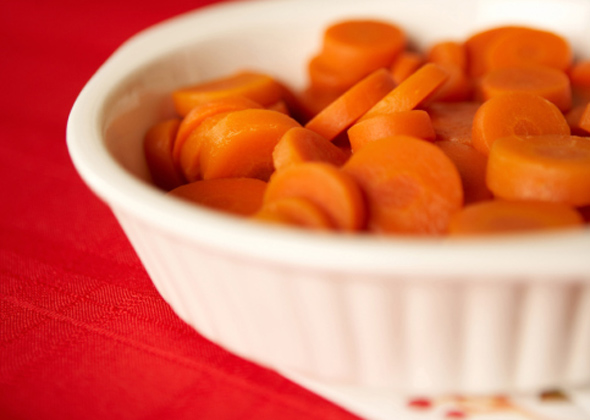
Where is `red tablecloth`? red tablecloth is located at coordinates (119, 307), (86, 26).